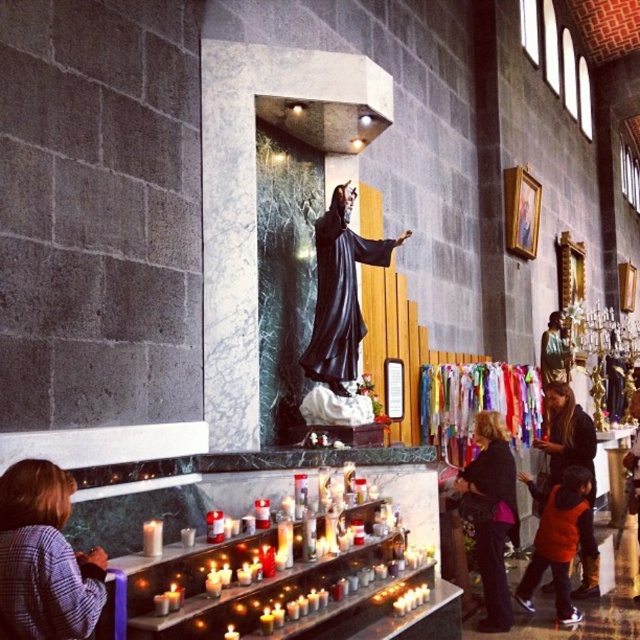
The image size is (640, 640). Describe the element at coordinates (44, 557) in the screenshot. I see `plaid shirt at lower left` at that location.

Is point (3, 573) less distant than point (492, 486)?

Yes, it is.

In order to click on plaid shirt at lower left in this screenshot , I will do `click(44, 557)`.

From the picture: Can you confirm if matte black statue at center is bigger than white wax candle at lower left?

Yes, matte black statue at center is bigger than white wax candle at lower left.

Where is `matte black statue at center`? matte black statue at center is located at coordinates (566, 435).

Is matte black jacket at center closer to camera compared to matte black statue at center?

That is True.

Does matte black jacket at center have a lesser height compared to matte black statue at center?

Incorrect, matte black jacket at center's height does not fall short of matte black statue at center's.

The image size is (640, 640). I want to click on matte black jacket at center, so click(x=492, y=513).